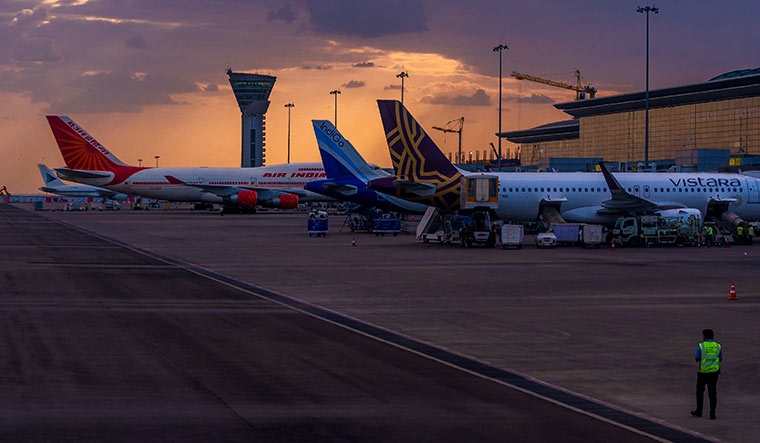
The width and height of the screenshot is (760, 443). Identify the location of lights. (501, 47), (401, 74), (287, 105), (331, 92), (644, 9), (156, 156), (138, 161).